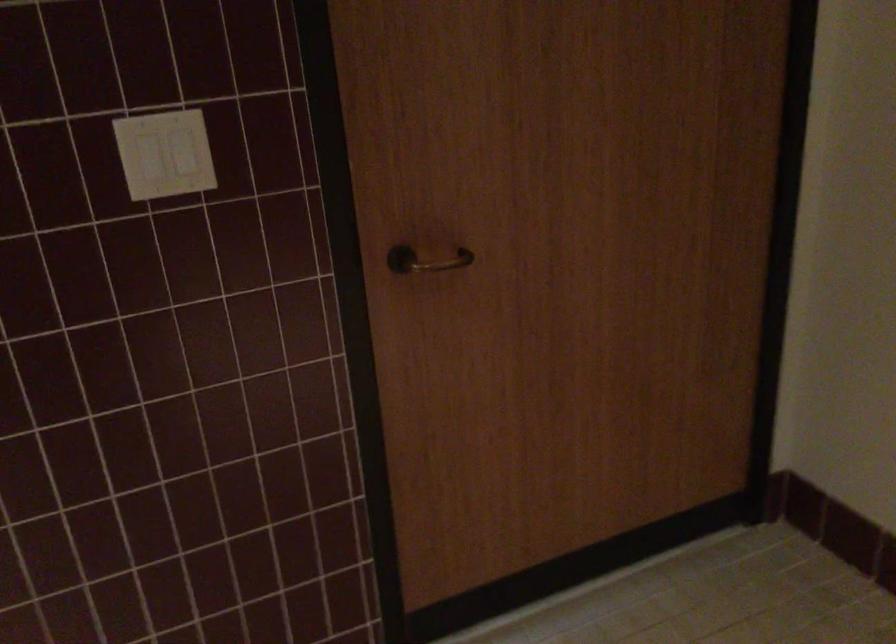
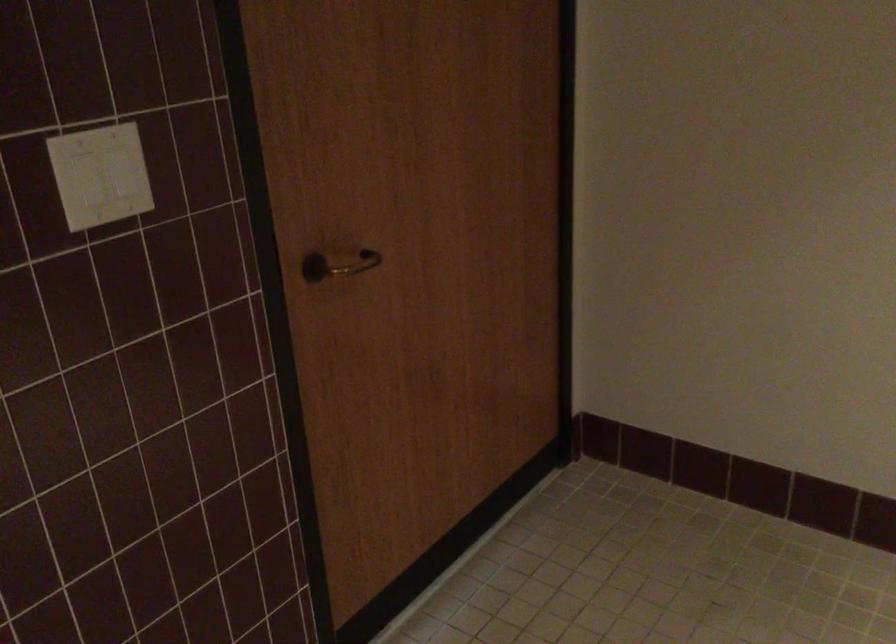
Question: In a continuous first-person perspective shot, in which direction is the camera moving?

Choices:
 (A) Left
 (B) Right
 (C) Forward
 (D) Backward

Answer: (A)